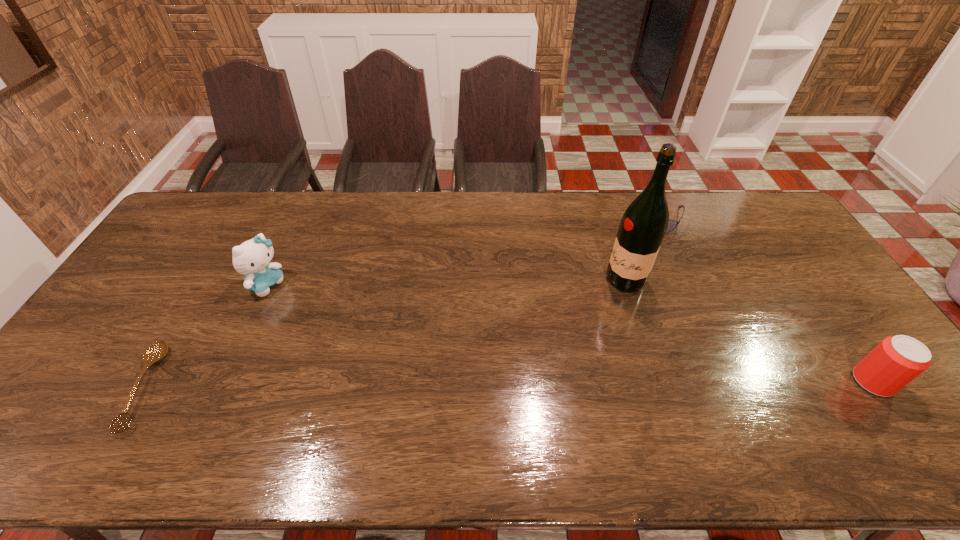
I want to click on vacant region at the near right corner of the desktop, so click(878, 413).

The height and width of the screenshot is (540, 960). Identify the location of free space between the beer can and the shortest object. (508, 384).

You are a GUI agent. You are given a task and a screenshot of the screen. Output one action in this format:
    pyautogui.click(x=<x>, y=<y>)
    Task: Click on the free space between the fourth shortest object and the beer can
    
    Given the screenshot: What is the action you would take?
    pyautogui.click(x=569, y=333)

At what (x,y) coordinates should I click in order to perform the action: click on free space between the second object from left to right and the shortest object. Please return your answer as a coordinate pair (x, y). The height and width of the screenshot is (540, 960). Looking at the image, I should click on (205, 335).

At what (x,y) coordinates should I click in order to perform the action: click on free space between the leftmost object and the liquor. Please return your answer as a coordinate pair (x, y). Looking at the image, I should click on (385, 334).

Image resolution: width=960 pixels, height=540 pixels. Find the location of `free space between the second object from left to right and the shortest object`. free space between the second object from left to right and the shortest object is located at coordinates (205, 335).

In order to click on vacant space that is in between the farthest object and the rightmost object in this screenshot , I will do `click(764, 299)`.

Locate an element on the screen. unoccupied position between the leftmost object and the second object from left to right is located at coordinates (205, 335).

Identify the location of unoccupied position between the second shortest object and the leftmost object. The width and height of the screenshot is (960, 540). (400, 301).

You are a GUI agent. You are given a task and a screenshot of the screen. Output one action in this format:
    pyautogui.click(x=<x>, y=<y>)
    Task: Click on the free area in between the tallest object and the leftmost object
    Image resolution: width=960 pixels, height=540 pixels.
    Given the screenshot: What is the action you would take?
    pyautogui.click(x=385, y=334)